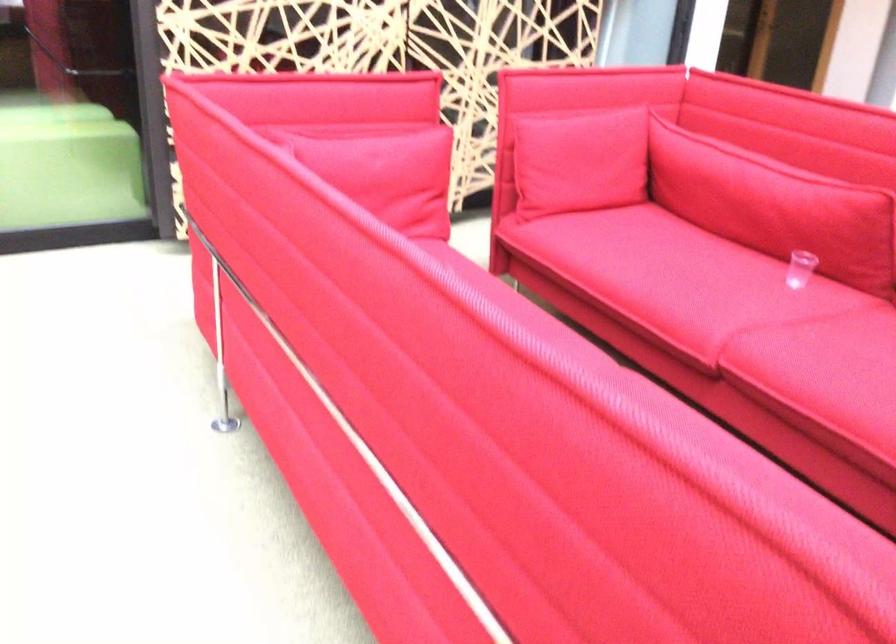
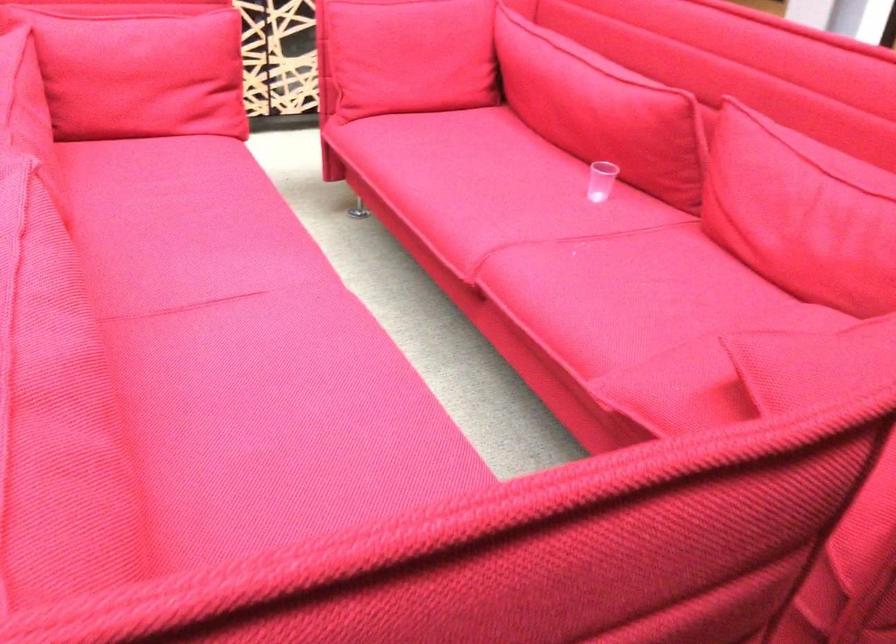
Find the pixel in the second image that matches (x=780, y=261) in the first image.

(600, 180)